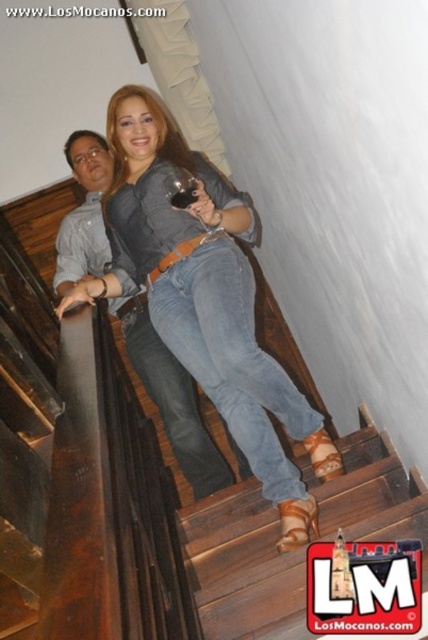
From the picture: Who is shorter, jeans at center or transparent glass at upper center?

transparent glass at upper center is shorter.

Can you confirm if jeans at center is positioned above transparent glass at upper center?

Incorrect, jeans at center is not positioned above transparent glass at upper center.

Locate an element on the screen. The image size is (428, 640). jeans at center is located at coordinates (232, 358).

The image size is (428, 640). What are the coordinates of `jeans at center` in the screenshot? It's located at (232, 358).

Can you confirm if jeans at center is positioned to the right of brushed metal shirt at upper left?

Yes, jeans at center is to the right of brushed metal shirt at upper left.

Who is more distant from viewer, (207,310) or (201,440)?

The point (201,440) is more distant.

The height and width of the screenshot is (640, 428). In order to click on jeans at center in this screenshot , I will do `click(232, 358)`.

Is the position of brushed metal shirt at upper left less distant than that of transparent glass at upper center?

No.

Who is higher up, brushed metal shirt at upper left or transparent glass at upper center?

transparent glass at upper center is higher up.

Describe the element at coordinates (172, 397) in the screenshot. This screenshot has height=640, width=428. I see `brushed metal shirt at upper left` at that location.

Where is `brushed metal shirt at upper left`? This screenshot has height=640, width=428. brushed metal shirt at upper left is located at coordinates (172, 397).